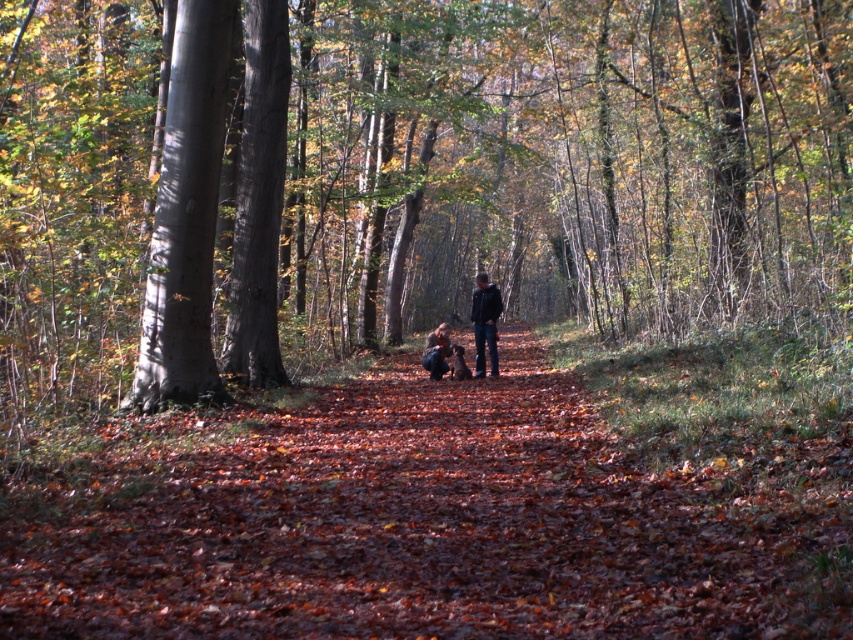
Question: Which point is farther to the camera?

Choices:
 (A) smooth bark tree at left
 (B) dark blue jacket at center
 (C) brown leafy forest path at center

Answer: (B)

Question: Which object appears farthest from the camera in this image?

Choices:
 (A) smooth bark tree at center
 (B) brown leafy forest path at center
 (C) dark blue jeans at center

Answer: (C)

Question: In this image, where is smooth bark tree at center located relative to dark blue jeans at center?

Choices:
 (A) below
 (B) above

Answer: (B)

Question: Can you confirm if smooth bark tree at left is positioned to the left of dark blue jacket at center?

Choices:
 (A) yes
 (B) no

Answer: (A)

Question: Among these points, which one is nearest to the camera?

Choices:
 (A) (486, 326)
 (B) (438, 355)
 (C) (204, 177)
 (D) (604, 456)

Answer: (D)

Question: Does smooth bark tree at left appear on the right side of dark blue jeans at center?

Choices:
 (A) no
 (B) yes

Answer: (A)